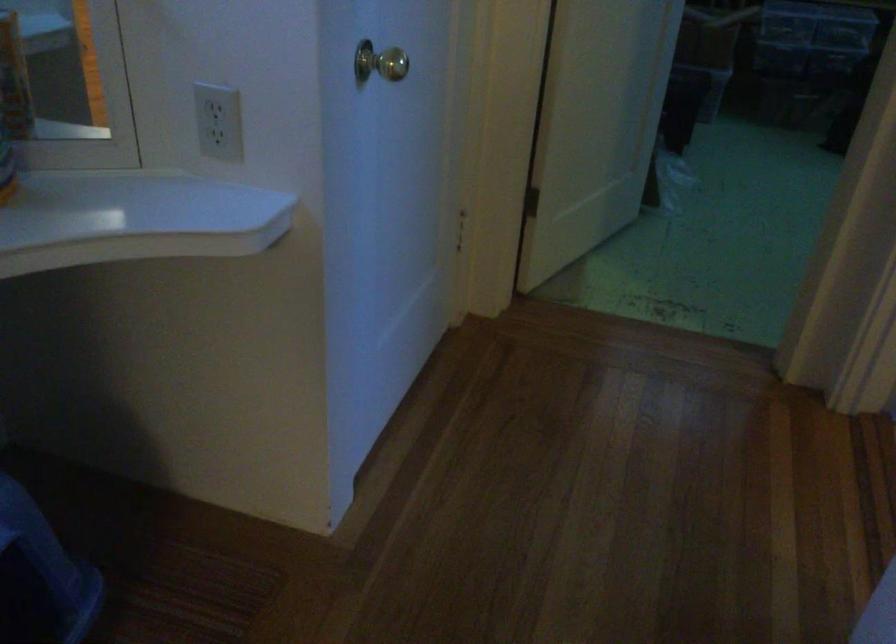
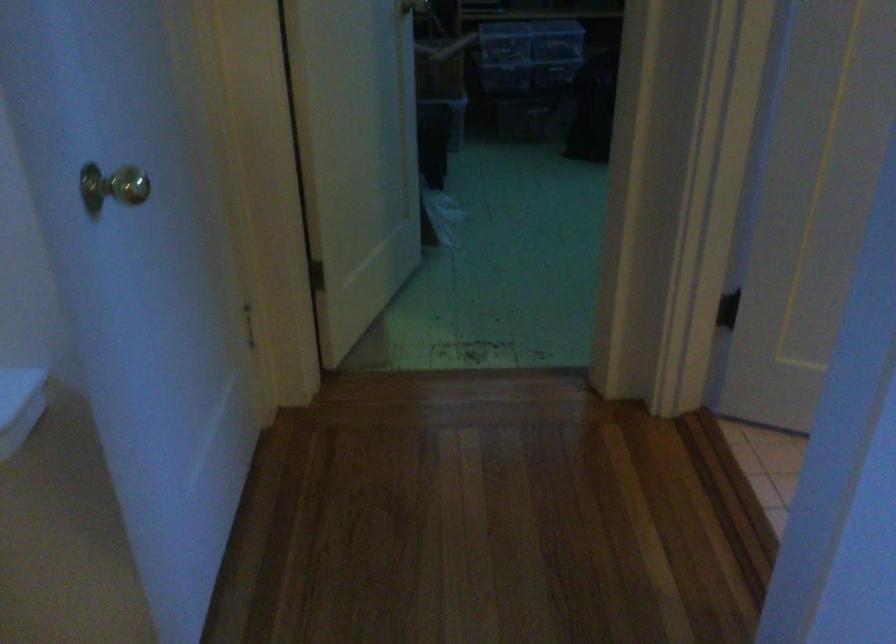
Question: The images are taken continuously from a first-person perspective. In which direction is your viewpoint rotating?

Choices:
 (A) Left
 (B) Right
 (C) Up
 (D) Down

Answer: (B)